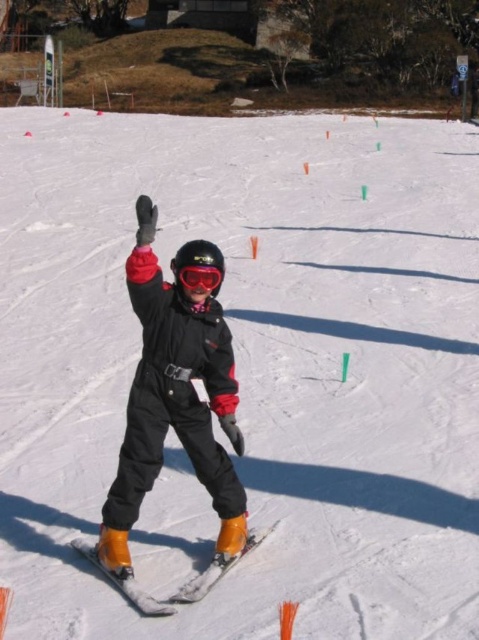
Based on the scene description, where is the orange matte ski at center located in terms of coordinates?

The orange matte ski at center is located at coordinates point (180, 588).